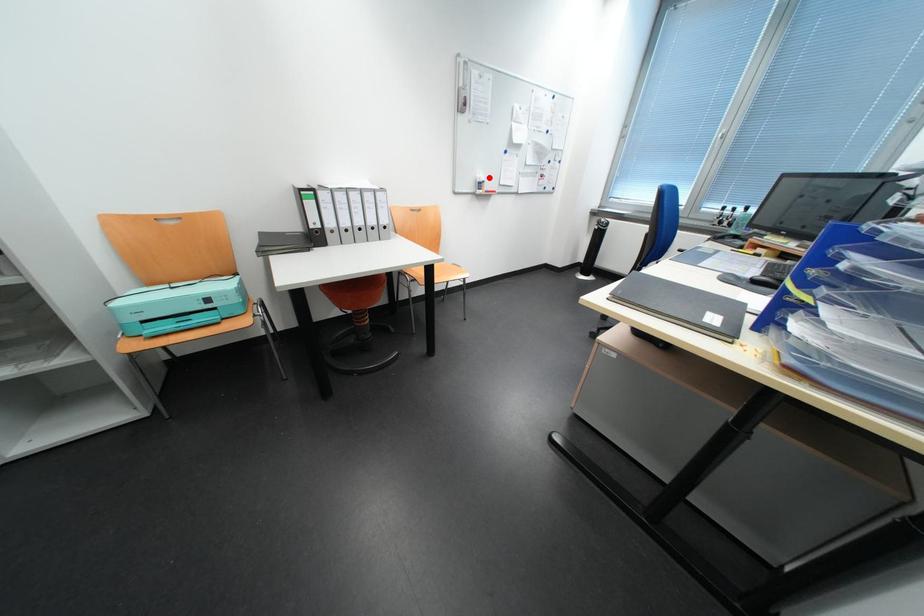
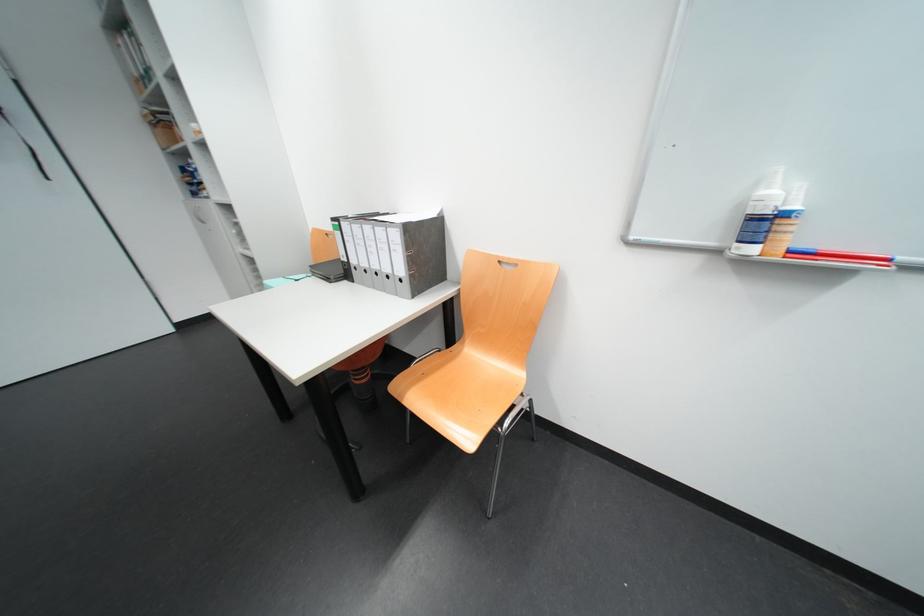
Locate, in the second image, the point that corresponds to the highlighted location in the first image.

(773, 193)